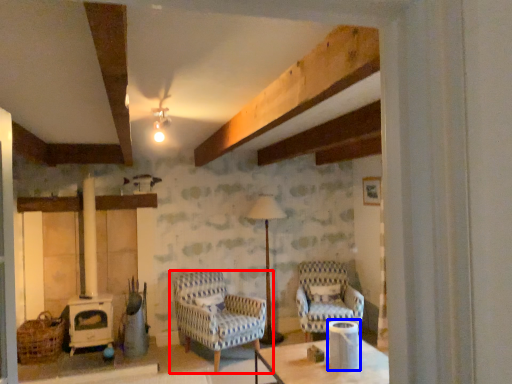
Question: Which point is closer to the camera, chair (highlighted by a red box) or appliance (highlighted by a blue box)?

Choices:
 (A) chair
 (B) appliance

Answer: (B)